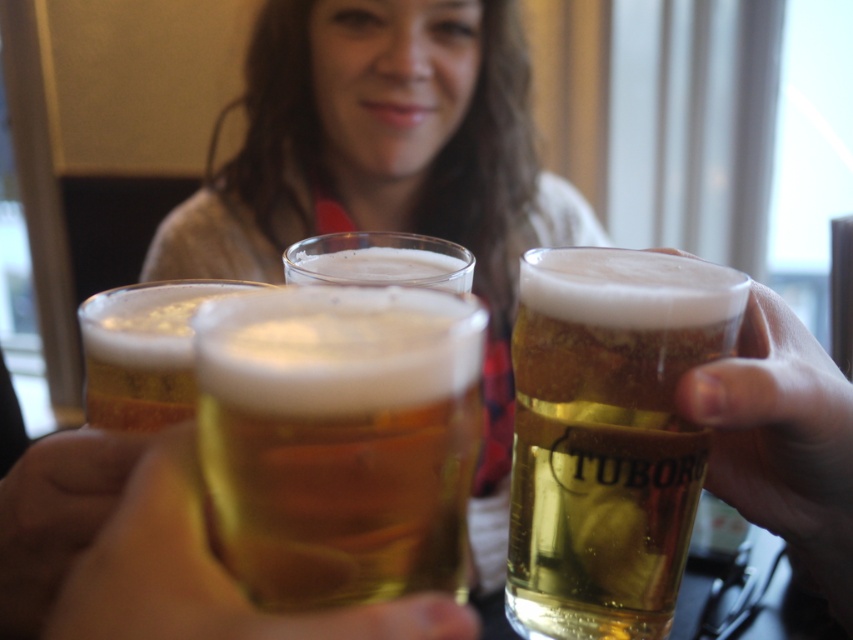
Can you confirm if golden glass mug at center is wider than translucent glass at center?

In fact, golden glass mug at center might be narrower than translucent glass at center.

Between golden glass mug at center and translucent glass at center, which one appears on the right side from the viewer's perspective?

golden glass mug at center is more to the right.

Describe the element at coordinates (339, 440) in the screenshot. This screenshot has height=640, width=853. I see `golden glass mug at center` at that location.

Identify the location of golden glass mug at center. This screenshot has height=640, width=853. (339, 440).

Who is positioned more to the right, translucent glass mug at center or translucent glass at center?

translucent glass mug at center is more to the right.

Is translucent glass mug at center thinner than translucent glass at center?

Yes.

Between point (592, 506) and point (54, 522), which one is positioned behind?

The point (592, 506) is behind.

Image resolution: width=853 pixels, height=640 pixels. I want to click on translucent glass mug at center, so click(x=608, y=435).

Can you confirm if translucent glass mug at center is positioned to the left of golden glass beer at center?

No, translucent glass mug at center is not to the left of golden glass beer at center.

Is point (589, 376) positioned before point (112, 356)?

No, it is behind (112, 356).

The width and height of the screenshot is (853, 640). Identify the location of translucent glass mug at center. [608, 435].